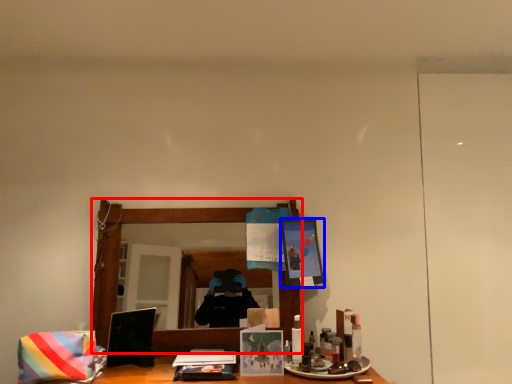
Question: Which object appears farthest to the camera in this image, mirror (highlighted by a red box) or picture frame (highlighted by a blue box)?

Choices:
 (A) mirror
 (B) picture frame

Answer: (B)